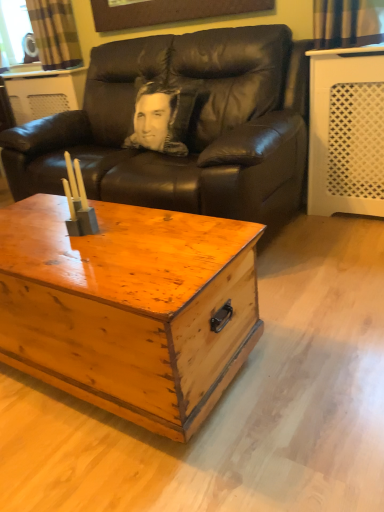
What do you see at coordinates (129, 307) in the screenshot? I see `wooden chest at center` at bounding box center [129, 307].

Identify the location of plaid fabric curtain at upper left. (55, 33).

This screenshot has height=512, width=384. I want to click on black leather couch at center, so click(x=189, y=128).

Is point (3, 158) closer or farther from the camera than point (71, 14)?

Point (3, 158).

From a real-world perspective, which object stands above the other?

From a 3D spatial view, plaid fabric curtain at upper left is above.

Between black leather couch at center and plaid fabric curtain at upper left, which one has smaller size?

Smaller between the two is plaid fabric curtain at upper left.

Is black leather couch at center positioned with its back to plaid fabric curtain at upper left?

black leather couch at center is not turned away from plaid fabric curtain at upper left.

Looking at this image, from the image's perspective, is plaid fabric curtain at upper left located above or below wooden chest at center?

Clearly, from the image's perspective, plaid fabric curtain at upper left is above wooden chest at center.

Considering the relative positions of plaid fabric curtain at upper left and wooden chest at center in the image provided, is plaid fabric curtain at upper left behind wooden chest at center?

Yes, it is behind wooden chest at center.

The height and width of the screenshot is (512, 384). I want to click on coffee table in front of the plaid fabric curtain at upper left, so click(129, 307).

Can you confirm if plaid fabric curtain at upper left is shorter than wooden chest at center?

Indeed, plaid fabric curtain at upper left has a lesser height compared to wooden chest at center.

Measure the distance from black leather couch at center to wooden chest at center.

28.84 inches.

Does point (267, 233) come in front of point (62, 198)?

That is False.

How many degrees apart are the facing directions of black leather couch at center and wooden chest at center?

There is a 0.994-degree angle between the facing directions of black leather couch at center and wooden chest at center.

Is black leather couch at center oriented away from wooden chest at center?

black leather couch at center does not have its back to wooden chest at center.

Which is behind, point (160, 282) or point (112, 68)?

The point (112, 68) is behind.

Consider the image. Between wooden chest at center and black leather couch at center, which one is positioned in front?

wooden chest at center.

How much distance is there between wooden chest at center and black leather couch at center?

A distance of 28.84 inches exists between wooden chest at center and black leather couch at center.

This screenshot has height=512, width=384. Identify the location of coffee table located on the left of black leather couch at center. (129, 307).

Who is taller, plaid fabric curtain at upper left or black leather couch at center?

black leather couch at center is taller.

In the scene shown: Can you confirm if plaid fabric curtain at upper left is thinner than black leather couch at center?

Yes.

Is plaid fabric curtain at upper left oriented towards black leather couch at center?

No, plaid fabric curtain at upper left is not aimed at black leather couch at center.

Is there a large distance between plaid fabric curtain at upper left and black leather couch at center?

Actually, plaid fabric curtain at upper left and black leather couch at center are a little close together.

How different are the orientations of wooden chest at center and plaid fabric curtain at upper left in degrees?

They differ by 2.53 degrees in their facing directions.

In order to click on coffee table located in front of the plaid fabric curtain at upper left in this screenshot , I will do `click(129, 307)`.

Is wooden chest at center further to camera compared to plaid fabric curtain at upper left?

No, it is not.

Which is correct: wooden chest at center is inside plaid fabric curtain at upper left, or outside of it?

wooden chest at center is not inside plaid fabric curtain at upper left, it's outside.

The height and width of the screenshot is (512, 384). What are the coordinates of `studio couch below the plaid fabric curtain at upper left (from the image's perspective)` in the screenshot? It's located at (189, 128).

Locate an element on the screen. Image resolution: width=384 pixels, height=512 pixels. curtain above the wooden chest at center (from a real-world perspective) is located at coordinates 55,33.

When comparing their distances from black leather couch at center, does wooden chest at center or plaid fabric curtain at upper left seem closer?

wooden chest at center is closer to black leather couch at center.

Based on their spatial positions, is plaid fabric curtain at upper left or wooden chest at center closer to black leather couch at center?

Based on the image, wooden chest at center appears to be nearer to black leather couch at center.

Considering their positions, is plaid fabric curtain at upper left positioned closer to wooden chest at center than black leather couch at center?

black leather couch at center.

Considering their positions, is black leather couch at center positioned further to wooden chest at center than plaid fabric curtain at upper left?

Among the two, plaid fabric curtain at upper left is located further to wooden chest at center.

Estimate the real-world distances between objects in this image. Which object is closer to plaid fabric curtain at upper left, wooden chest at center or black leather couch at center?

black leather couch at center is closer to plaid fabric curtain at upper left.

Based on their spatial positions, is black leather couch at center or wooden chest at center further from plaid fabric curtain at upper left?

wooden chest at center lies further to plaid fabric curtain at upper left than the other object.

This screenshot has width=384, height=512. Find the location of `studio couch positioned between wooden chest at center and plaid fabric curtain at upper left from near to far`. studio couch positioned between wooden chest at center and plaid fabric curtain at upper left from near to far is located at coordinates (189, 128).